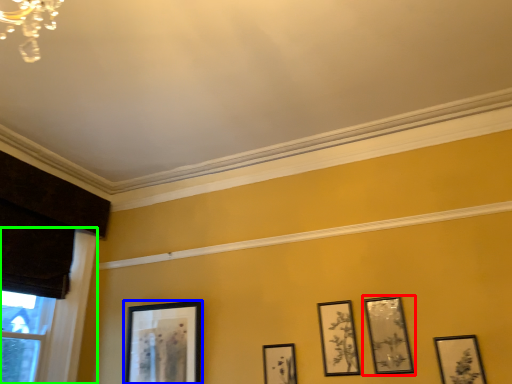
Question: Which object is the farthest from picture frame (highlighted by a red box)? Choose among these: picture frame (highlighted by a blue box) or window frame (highlighted by a green box).

Choices:
 (A) picture frame
 (B) window frame

Answer: (B)